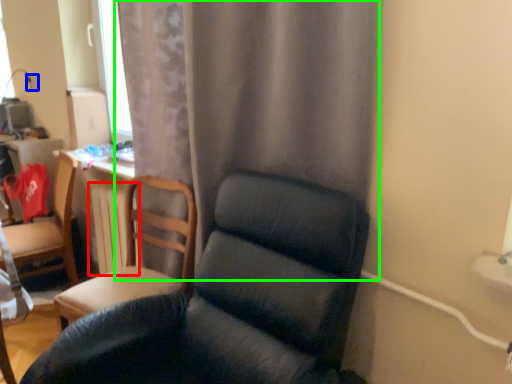
Question: Considering the real-world distances, which object is closest to radiator (highlighted by a red box)? electric outlet (highlighted by a blue box) or curtain (highlighted by a green box).

Choices:
 (A) electric outlet
 (B) curtain

Answer: (B)